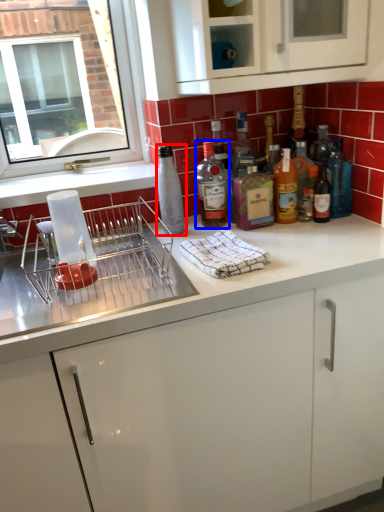
Question: Which point is closer to the camera, bottle (highlighted by a red box) or bottle (highlighted by a blue box)?

Choices:
 (A) bottle
 (B) bottle

Answer: (A)